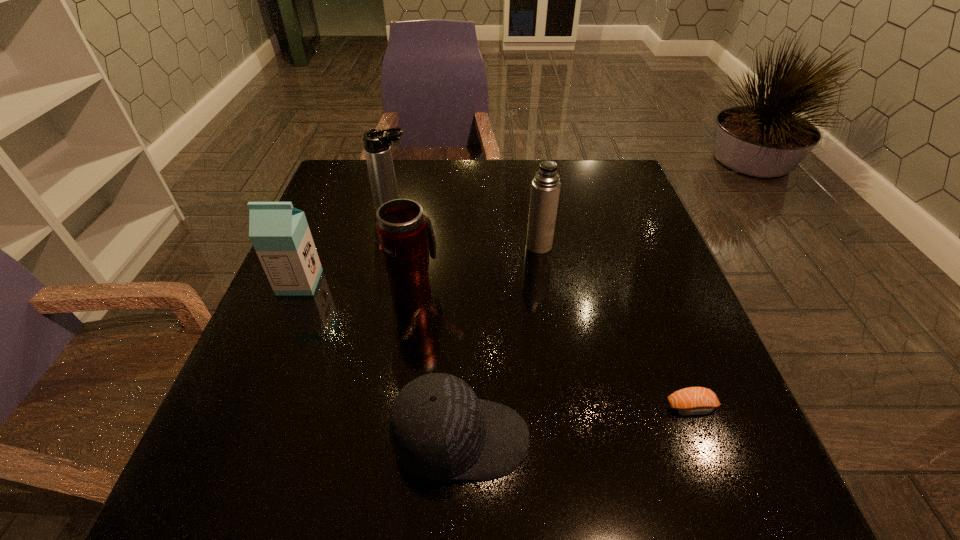
Find the location of a particular element. free region located 0.330m on the side with the handle of the nearest thermos bottle is located at coordinates (429, 194).

Locate an element on the screen. vacant space located on the side with the handle of the nearest thermos bottle is located at coordinates (426, 213).

Image resolution: width=960 pixels, height=540 pixels. Identify the location of free point located on the right of the second object from right to left. (589, 246).

What are the coordinates of `free region located 0.320m on the back of the milk carton` in the screenshot? It's located at (338, 192).

Identify the location of blank space located 0.320m at the front of the baseball cap where the brim is located. (726, 438).

Where is `vacant area situated on the back of the shortest object`? The image size is (960, 540). vacant area situated on the back of the shortest object is located at coordinates (657, 315).

Where is `object that is at the far edge`? object that is at the far edge is located at coordinates tap(377, 148).

Find the location of a particular element. The height and width of the screenshot is (540, 960). object positioned at the near edge is located at coordinates (439, 430).

The height and width of the screenshot is (540, 960). Find the location of `thermos bottle that is at the left edge`. thermos bottle that is at the left edge is located at coordinates (377, 148).

Locate an element on the screen. Image resolution: width=960 pixels, height=540 pixels. milk carton that is at the left edge is located at coordinates (279, 232).